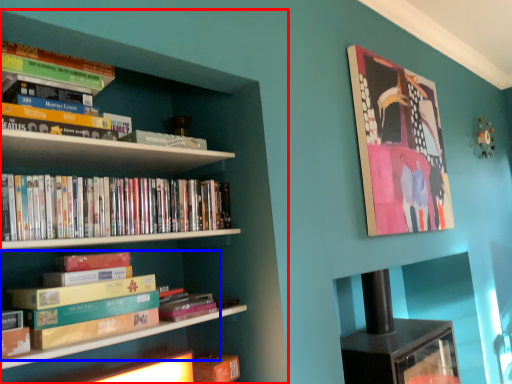
Question: Which point is closer to the camera, bookcase (highlighted by a red box) or book (highlighted by a blue box)?

Choices:
 (A) bookcase
 (B) book

Answer: (A)